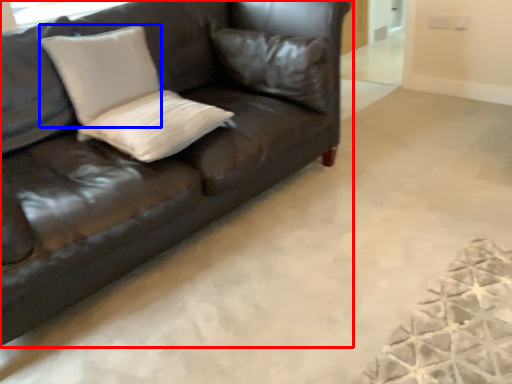
Question: Which object appears farthest to the camera in this image, studio couch (highlighted by a red box) or pillow (highlighted by a blue box)?

Choices:
 (A) studio couch
 (B) pillow

Answer: (B)